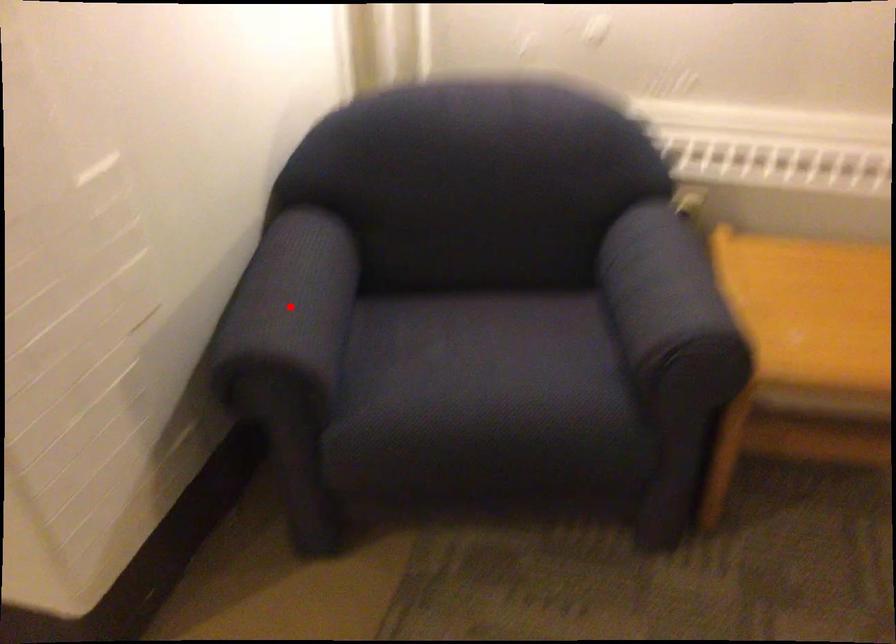
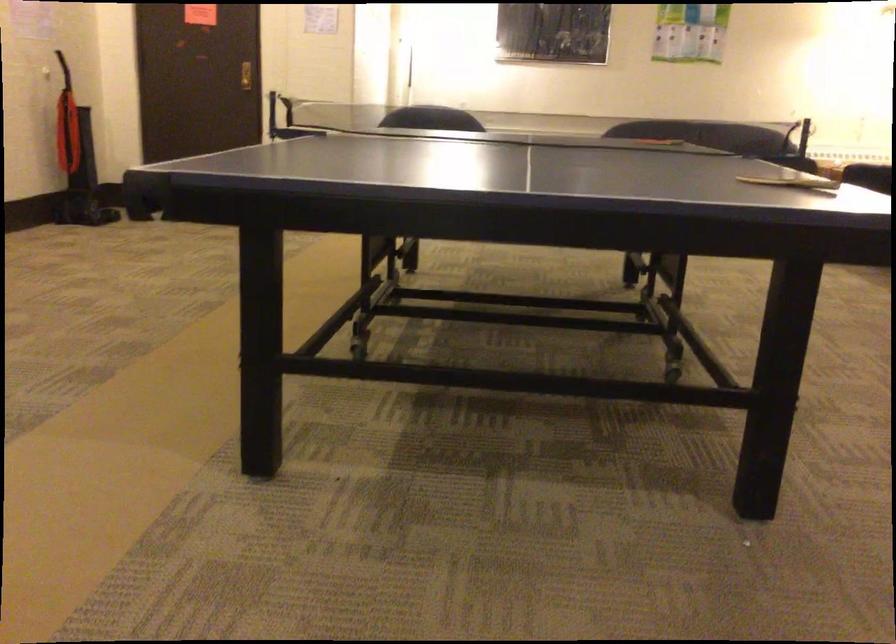
Question: I am providing you with two images of the same scene from different viewpoints. A red point is marked on the first image. Is the red point's position out of view in image 2?

Choices:
 (A) Yes
 (B) No

Answer: (A)